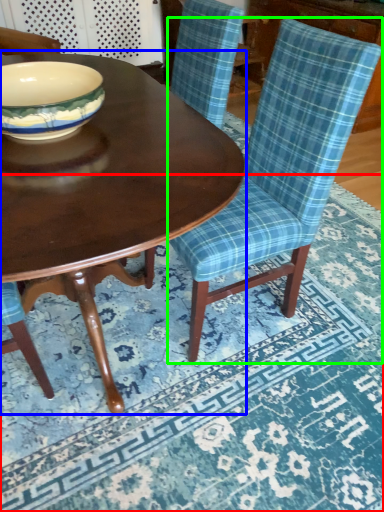
Question: Which is farther away from place mat (highlighted by a red box)? coffee table (highlighted by a blue box) or chair (highlighted by a green box)?

Choices:
 (A) coffee table
 (B) chair

Answer: (A)